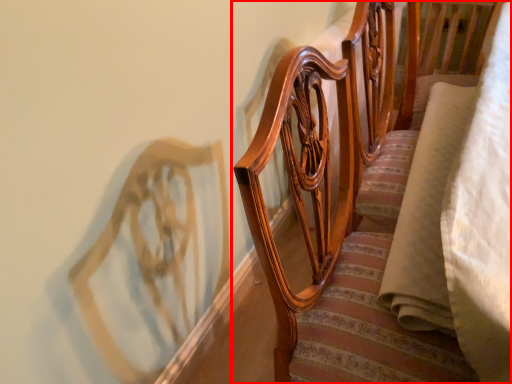
Question: From the image's perspective, what is the correct spatial relationship of furniture (annotated by the red box) in relation to fabric?

Choices:
 (A) above
 (B) below

Answer: (B)